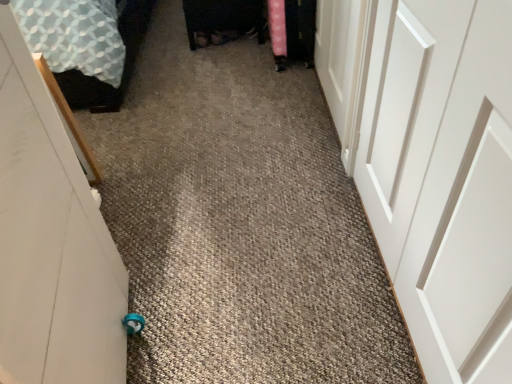
At what (x,y) coordinates should I click in order to perform the action: click on free space in front of white matte door at upper right, positioned as the 2th door in right-to-left order. Please return your answer as a coordinate pair (x, y). The height and width of the screenshot is (384, 512). Looking at the image, I should click on (284, 175).